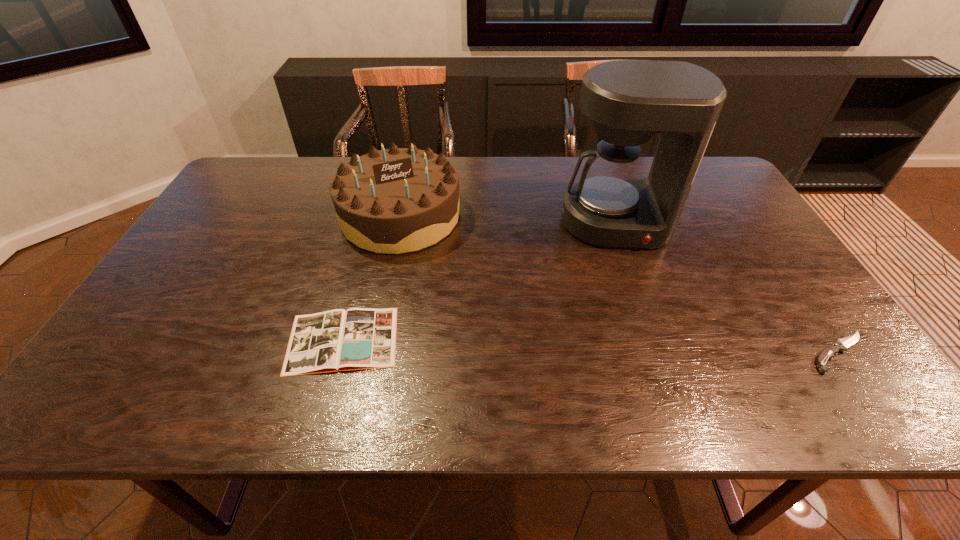
Find the location of a particular element. The image size is (960, 540). vacant region between the birthday cake and the second object from right to left is located at coordinates (508, 220).

The width and height of the screenshot is (960, 540). I want to click on vacant space that is in between the birthday cake and the rightmost object, so click(620, 284).

Locate which object ranks in proximity to the birthday cake. Please provide its 2D coordinates. Your answer should be formatted as a tuple, i.e. [(x, y)], where the tuple contains the x and y coordinates of a point satisfying the conditions above.

[(337, 340)]

Identify the location of the third closest object to the book. (827, 353).

Find the location of a particular element. blank space that satisfies the following two spatial constraints: 1. on the front side of the rightmost object; 2. on the right side of the book is located at coordinates (339, 352).

Locate an element on the screen. The height and width of the screenshot is (540, 960). vacant space that satisfies the following two spatial constraints: 1. on the front side of the rightmost object; 2. on the left side of the book is located at coordinates (339, 352).